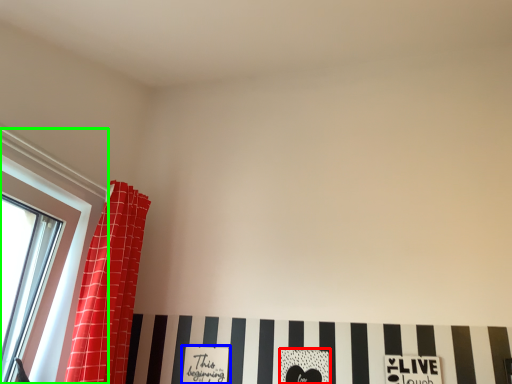
Question: Based on their relative distances, which object is nearer to print (highlighted by a red box)? Choose from print (highlighted by a blue box) and window (highlighted by a green box).

Choices:
 (A) print
 (B) window

Answer: (A)